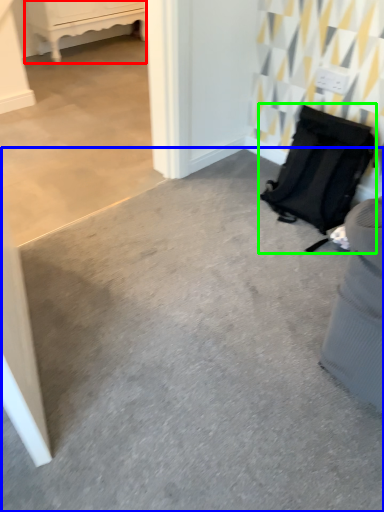
Question: Considering the real-world distances, which object is farthest from furniture (highlighted by a red box)? concrete (highlighted by a blue box) or luggage and bags (highlighted by a green box)?

Choices:
 (A) concrete
 (B) luggage and bags

Answer: (A)